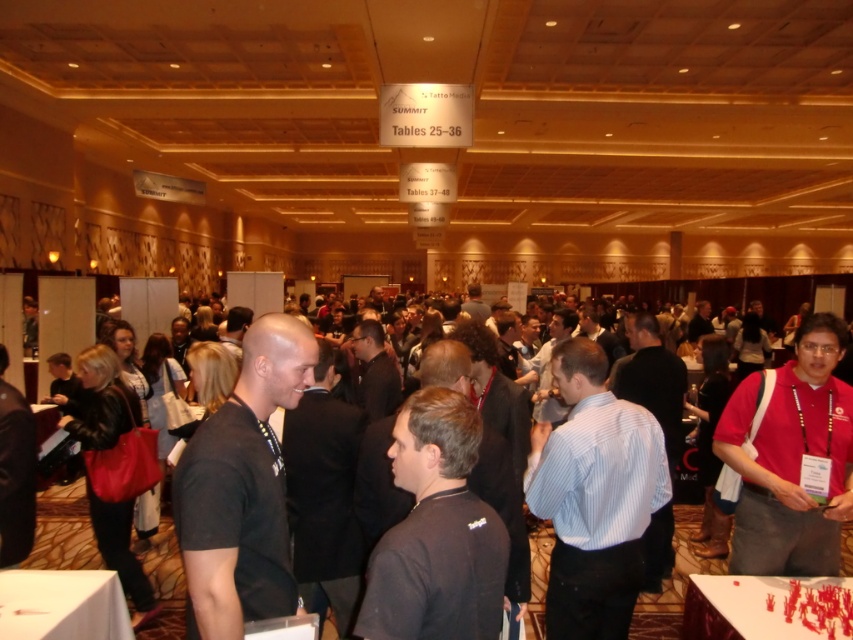
You are organizing a photo shoot and need to ensure that the matte red shirt at center and the white paper table at center are both visible in the frame. Given their sizes, which object will require more space horizontally to capture fully in the photo?

The white paper table at center requires more horizontal space because its width is greater than the matte red shirt at center.

You are organizing a photo shoot and need to ensure that the matte red shirt at center and the white paper at lower left are visible in the frame. Based on their sizes, which object would require more space horizontally in the composition?

The matte red shirt at center requires more horizontal space in the composition because its width surpasses that of the white paper at lower left.

You are attending a conference and need to locate someone wearing a matte red shirt at center. According to the spatial coordinates provided, where exactly would you find this person in the image?

The matte red shirt at center is located at point coordinates 0.719 on the x axis and 0.930 on the y axis.